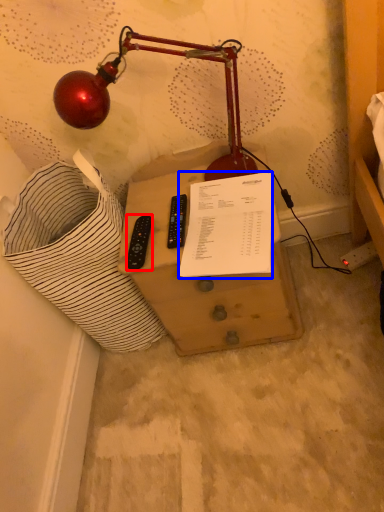
Question: Which object appears farthest to the camera in this image, control (highlighted by a red box) or document (highlighted by a blue box)?

Choices:
 (A) control
 (B) document

Answer: (A)